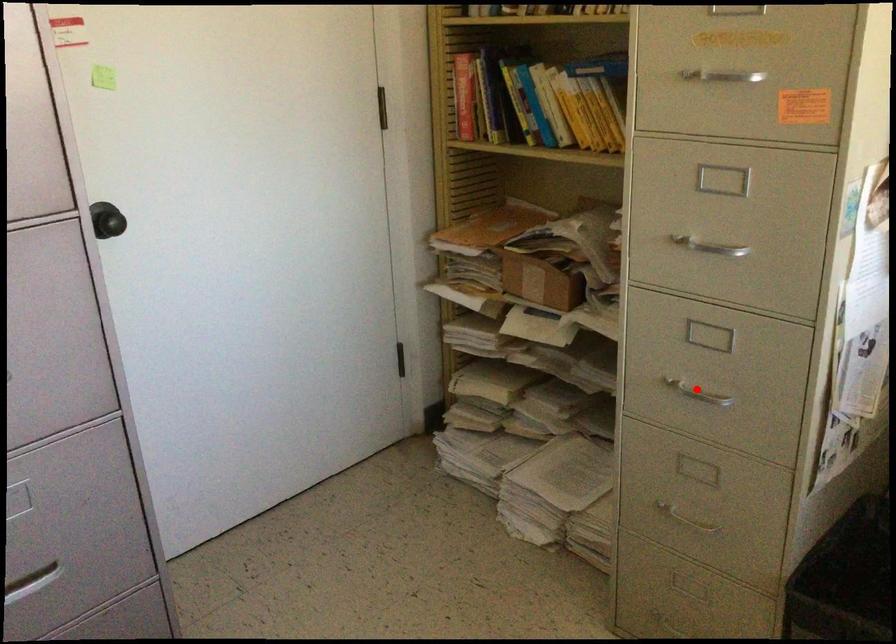
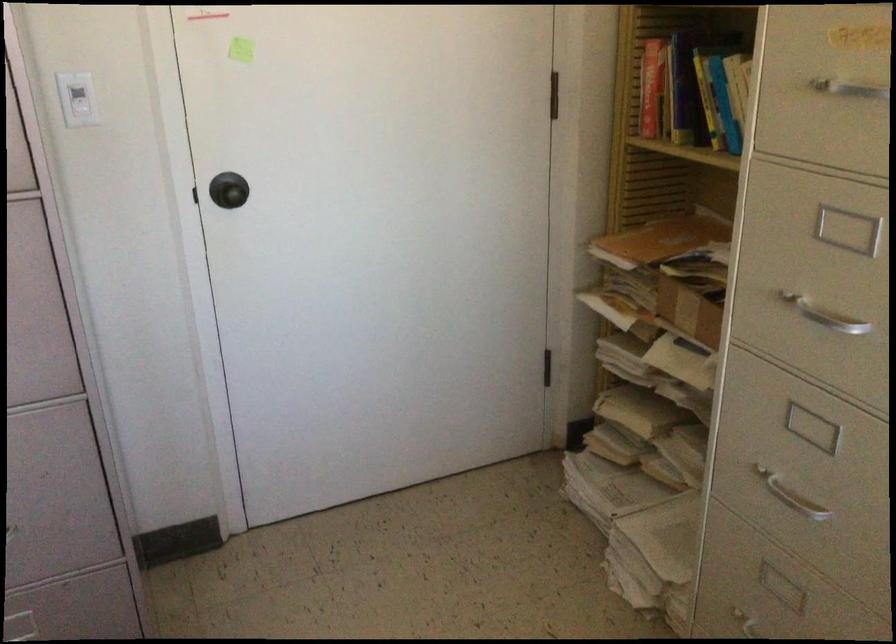
Question: I am providing you with two images of the same scene from different viewpoints. A red point is shown in image1. For the corresponding object point in image2, is it positioned nearer or farther from the camera?

Choices:
 (A) Nearer
 (B) Farther

Answer: (A)